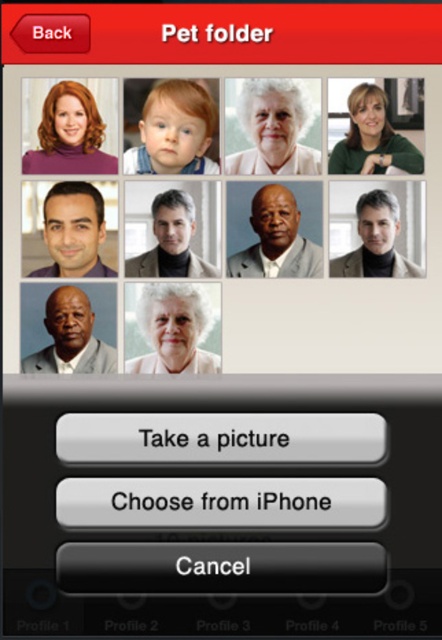
Which is below, gray suit jacket at center or green matte shirt at upper right?

gray suit jacket at center

Who is taller, gray suit jacket at center or green matte shirt at upper right?

gray suit jacket at center is taller.

Between point (57, 307) and point (373, 172), which one is positioned behind?

Positioned behind is point (57, 307).

You are a GUI agent. You are given a task and a screenshot of the screen. Output one action in this format:
    pyautogui.click(x=<x>, y=<y>)
    Task: Click on the gray suit jacket at center
    Image resolution: width=442 pixels, height=640 pixels.
    Given the screenshot: What is the action you would take?
    pyautogui.click(x=71, y=337)

Is point (320, 314) positioned after point (247, 148)?

Yes, it is.

Locate an element on the screen. The height and width of the screenshot is (640, 442). matte black laptop at upper left is located at coordinates (224, 227).

Image resolution: width=442 pixels, height=640 pixels. What are the coordinates of `matte black laptop at upper left` in the screenshot? It's located at (224, 227).

Between point (416, 465) and point (290, 77), which one is positioned in front?

Positioned in front is point (416, 465).

Find the location of a particular element. The image size is (442, 640). black glossy button at bottom center is located at coordinates (221, 504).